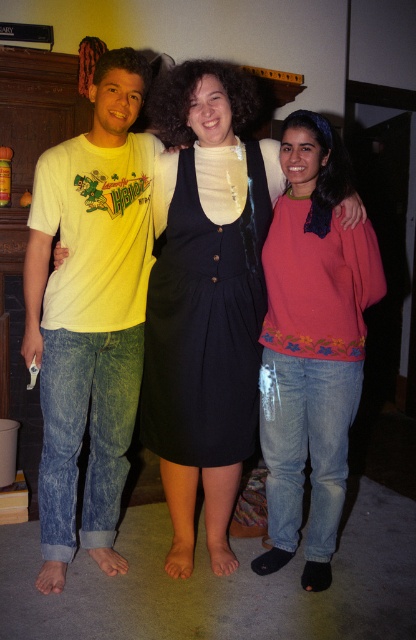
Does pink fleece sweater at center have a lesser width compared to matte black dress at center?

Correct, pink fleece sweater at center's width is less than matte black dress at center's.

Does pink fleece sweater at center appear on the left side of matte black dress at center?

No, pink fleece sweater at center is not to the left of matte black dress at center.

This screenshot has width=416, height=640. Describe the element at coordinates (312, 342) in the screenshot. I see `pink fleece sweater at center` at that location.

I want to click on pink fleece sweater at center, so click(312, 342).

Is yellow cotton t-shirt at left below pink fleece sweater at center?

Actually, yellow cotton t-shirt at left is above pink fleece sweater at center.

In the scene shown: Is yellow cotton t-shirt at left to the right of pink fleece sweater at center from the viewer's perspective?

No, yellow cotton t-shirt at left is not to the right of pink fleece sweater at center.

What do you see at coordinates (89, 312) in the screenshot?
I see `yellow cotton t-shirt at left` at bounding box center [89, 312].

The height and width of the screenshot is (640, 416). Identify the location of yellow cotton t-shirt at left. (89, 312).

Can you confirm if yellow cotton t-shirt at left is positioned to the right of matte black dress at center?

Incorrect, yellow cotton t-shirt at left is not on the right side of matte black dress at center.

Which is more to the left, yellow cotton t-shirt at left or matte black dress at center?

yellow cotton t-shirt at left

At what (x,y) coordinates should I click in order to perform the action: click on yellow cotton t-shirt at left. Please return your answer as a coordinate pair (x, y). The width and height of the screenshot is (416, 640). Looking at the image, I should click on (89, 312).

Identify the location of yellow cotton t-shirt at left. (89, 312).